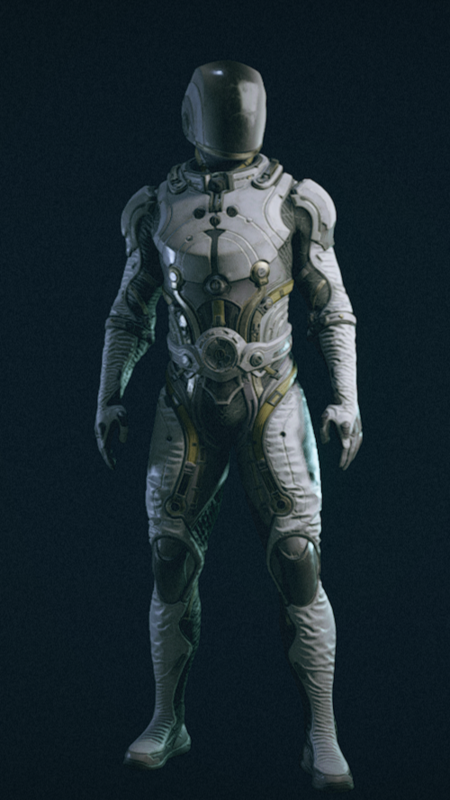
Locate an element on the screen. Image resolution: width=450 pixels, height=800 pixels. lace is located at coordinates (153, 726).